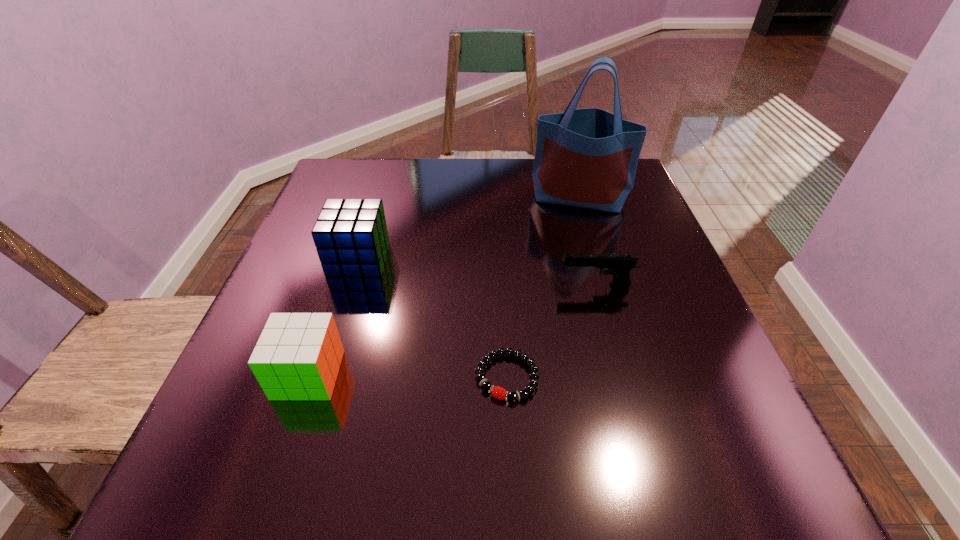
Where is `handbag`? The height and width of the screenshot is (540, 960). handbag is located at coordinates (588, 157).

Where is `the farthest object`? the farthest object is located at coordinates (588, 157).

What are the coordinates of `the farther cube` in the screenshot? It's located at (x=351, y=238).

The width and height of the screenshot is (960, 540). In order to click on the taller cube in this screenshot , I will do `click(351, 238)`.

The height and width of the screenshot is (540, 960). Identify the location of the nearer cube. (298, 355).

Image resolution: width=960 pixels, height=540 pixels. I want to click on pistol, so click(619, 265).

At what (x,y) coordinates should I click in order to perform the action: click on the fourth tallest object. Please return your answer as a coordinate pair (x, y). Looking at the image, I should click on (619, 265).

Where is `bracelet`? The width and height of the screenshot is (960, 540). bracelet is located at coordinates (497, 392).

Locate an element on the screen. This screenshot has width=960, height=540. the third object from left to right is located at coordinates pyautogui.click(x=497, y=392).

Where is `free space located 0.340m on the left of the tallest object`? The height and width of the screenshot is (540, 960). free space located 0.340m on the left of the tallest object is located at coordinates (398, 198).